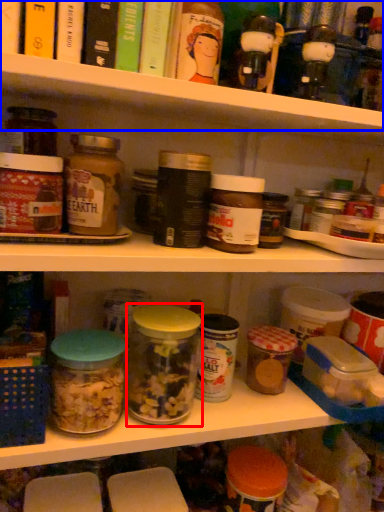
Question: Which object is closer to the camera taking this photo, glass jar (highlighted by a red box) or shelf (highlighted by a blue box)?

Choices:
 (A) glass jar
 (B) shelf

Answer: (B)